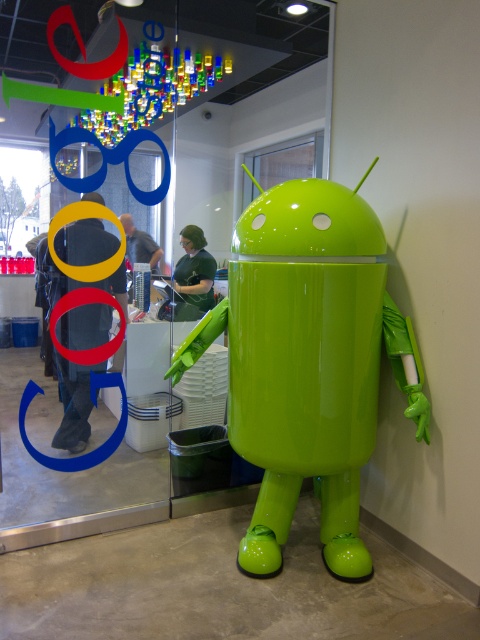
Question: Is glossy plastic android at center positioned in front of green glossy android at center?

Choices:
 (A) no
 (B) yes

Answer: (B)

Question: Is dark gray pants at center positioned behind green matte shirt at center?

Choices:
 (A) no
 (B) yes

Answer: (A)

Question: Which of these objects is positioned closest to the dark gray pants at center?

Choices:
 (A) green glossy android at center
 (B) green matte shirt at center
 (C) glossy plastic android at center

Answer: (A)

Question: Can you confirm if green matte shirt at center is positioned to the left of green glossy android at center?

Choices:
 (A) no
 (B) yes

Answer: (A)

Question: Estimate the real-world distances between objects in this image. Which object is closer to the green glossy android at center?

Choices:
 (A) dark gray pants at center
 (B) green matte shirt at center

Answer: (A)

Question: Which of the following is the farthest from the observer?

Choices:
 (A) green glossy android at center
 (B) green matte shirt at center

Answer: (B)